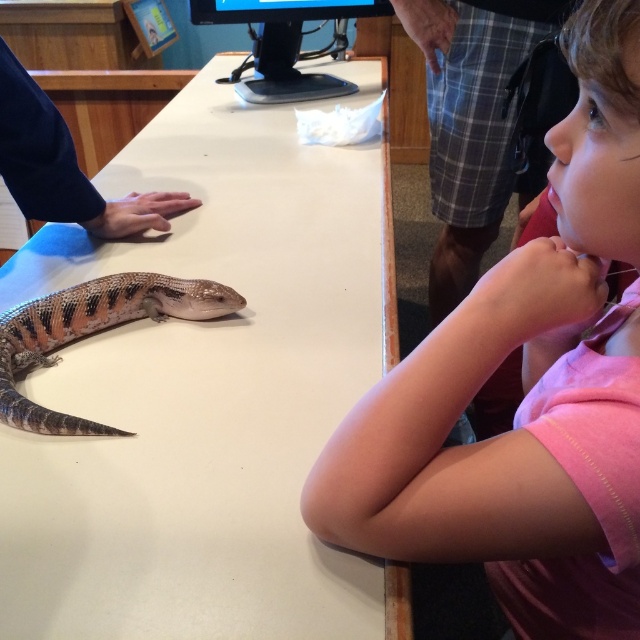
Between white smooth table at center and slate blue scaly lizard at center, which one appears on the right side from the viewer's perspective?

white smooth table at center

Where is `white smooth table at center`? This screenshot has width=640, height=640. white smooth table at center is located at coordinates (202, 394).

Describe the element at coordinates (202, 394) in the screenshot. This screenshot has height=640, width=640. I see `white smooth table at center` at that location.

Identify the location of white smooth table at center. The width and height of the screenshot is (640, 640). (202, 394).

Is white smooth table at center above pink cotton shirt at upper right?

Yes, white smooth table at center is above pink cotton shirt at upper right.

Is white smooth table at center closer to the viewer compared to pink cotton shirt at upper right?

No, white smooth table at center is behind pink cotton shirt at upper right.

Locate an element on the screen. white smooth table at center is located at coordinates 202,394.

Identify the location of white smooth table at center. (202, 394).

This screenshot has width=640, height=640. What do you see at coordinates (524, 390) in the screenshot? I see `pink cotton shirt at upper right` at bounding box center [524, 390].

Does pink cotton shirt at upper right have a greater width compared to slate blue scaly lizard at center?

Indeed, pink cotton shirt at upper right has a greater width compared to slate blue scaly lizard at center.

Does point (480, 358) come farther from viewer compared to point (38, 364)?

No, (480, 358) is closer to viewer.

Locate an element on the screen. This screenshot has width=640, height=640. pink cotton shirt at upper right is located at coordinates (524, 390).